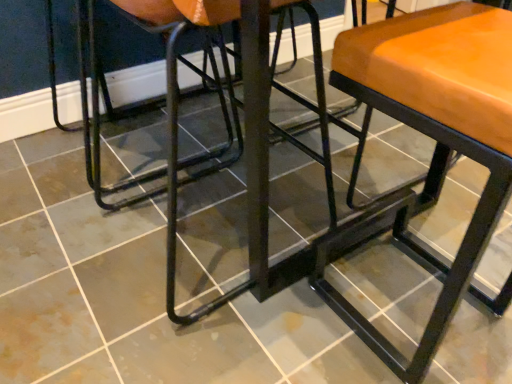
Question: Is matte orange cushioned stool at center to the left or to the right of black metal swivel chair at left in the image?

Choices:
 (A) left
 (B) right

Answer: (B)

Question: From the image's perspective, relative to black metal swivel chair at left, is matte orange cushioned stool at center above or below?

Choices:
 (A) above
 (B) below

Answer: (B)

Question: In terms of height, does matte orange cushioned stool at center look taller or shorter compared to black metal swivel chair at left?

Choices:
 (A) tall
 (B) short

Answer: (A)

Question: In the image, is black metal swivel chair at left on the left side or the right side of matte orange cushioned stool at center?

Choices:
 (A) right
 (B) left

Answer: (B)

Question: Considering their positions, is black metal swivel chair at left located in front of or behind matte orange cushioned stool at center?

Choices:
 (A) front
 (B) behind

Answer: (B)

Question: From a real-world perspective, relative to matte orange cushioned stool at center, is black metal swivel chair at left vertically above or below?

Choices:
 (A) above
 (B) below

Answer: (B)

Question: In terms of width, does black metal swivel chair at left look wider or thinner when compared to matte orange cushioned stool at center?

Choices:
 (A) thin
 (B) wide

Answer: (B)